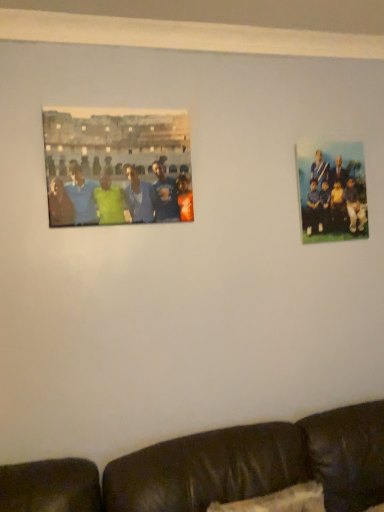
Question: Considering the relative sizes of matte plastic photo at upper left and formal attire group at upper right in the image provided, is matte plastic photo at upper left bigger than formal attire group at upper right?

Choices:
 (A) yes
 (B) no

Answer: (A)

Question: Is formal attire group at upper right a part of matte plastic photo at upper left?

Choices:
 (A) no
 (B) yes

Answer: (A)

Question: Considering the relative sizes of matte plastic photo at upper left and formal attire group at upper right in the image provided, is matte plastic photo at upper left taller than formal attire group at upper right?

Choices:
 (A) no
 (B) yes

Answer: (A)

Question: From the image's perspective, is matte plastic photo at upper left beneath formal attire group at upper right?

Choices:
 (A) yes
 (B) no

Answer: (B)

Question: Can we say matte plastic photo at upper left lies outside formal attire group at upper right?

Choices:
 (A) yes
 (B) no

Answer: (A)

Question: Is matte plastic photo at upper left to the right of formal attire group at upper right from the viewer's perspective?

Choices:
 (A) yes
 (B) no

Answer: (B)

Question: From a real-world perspective, is formal attire group at upper right under matte plastic photo at upper left?

Choices:
 (A) no
 (B) yes

Answer: (B)

Question: Considering the relative sizes of formal attire group at upper right and matte plastic photo at upper left in the image provided, is formal attire group at upper right bigger than matte plastic photo at upper left?

Choices:
 (A) no
 (B) yes

Answer: (A)

Question: Is formal attire group at upper right oriented towards matte plastic photo at upper left?

Choices:
 (A) no
 (B) yes

Answer: (A)

Question: Is formal attire group at upper right positioned behind matte plastic photo at upper left?

Choices:
 (A) yes
 (B) no

Answer: (A)

Question: Can you confirm if formal attire group at upper right is taller than matte plastic photo at upper left?

Choices:
 (A) no
 (B) yes

Answer: (B)

Question: From the image's perspective, does formal attire group at upper right appear higher than matte plastic photo at upper left?

Choices:
 (A) yes
 (B) no

Answer: (B)

Question: In the image, is formal attire group at upper right on the left side or the right side of matte plastic photo at upper left?

Choices:
 (A) right
 (B) left

Answer: (A)